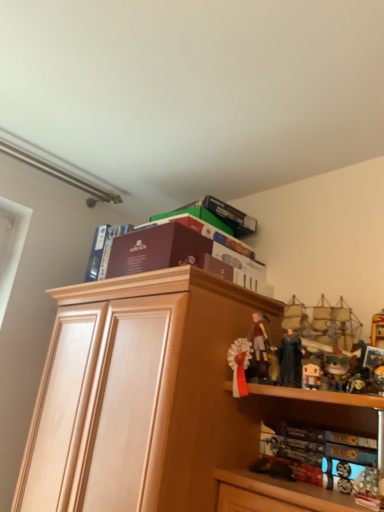
Question: From the image's perspective, is maroon cardboard book at upper center, which is counted as the 2th book, starting from the top, located beneath matte black figurine at upper right?

Choices:
 (A) yes
 (B) no

Answer: (B)

Question: Is maroon cardboard book at upper center, which appears as the third book when ordered from the bottom, oriented away from matte black figurine at upper right?

Choices:
 (A) no
 (B) yes

Answer: (A)

Question: Considering the relative positions of maroon cardboard book at upper center, which appears as the third book when ordered from the bottom, and matte black figurine at upper right in the image provided, is maroon cardboard book at upper center, which appears as the third book when ordered from the bottom, to the left of matte black figurine at upper right from the viewer's perspective?

Choices:
 (A) no
 (B) yes

Answer: (B)

Question: Does maroon cardboard book at upper center, which appears as the third book when ordered from the bottom, have a lesser height compared to matte black figurine at upper right?

Choices:
 (A) yes
 (B) no

Answer: (B)

Question: From a real-world perspective, is maroon cardboard book at upper center, which is counted as the 2th book, starting from the top, positioned under matte black figurine at upper right based on gravity?

Choices:
 (A) no
 (B) yes

Answer: (A)

Question: Is maroon cardboard box at upper center, the 2th book positioned from the bottom, bigger or smaller than matte brown box at upper center, the fourth book in the bottom-to-top sequence?

Choices:
 (A) big
 (B) small

Answer: (B)

Question: Is maroon cardboard box at upper center, marked as the third book in a top-to-bottom arrangement, inside or outside of matte brown box at upper center, the fourth book in the bottom-to-top sequence?

Choices:
 (A) outside
 (B) inside

Answer: (A)

Question: From their relative heights in the image, would you say maroon cardboard box at upper center, marked as the third book in a top-to-bottom arrangement, is taller or shorter than matte brown box at upper center, which ranks as the 1th book in top-to-bottom order?

Choices:
 (A) tall
 (B) short

Answer: (B)

Question: From the image's perspective, is maroon cardboard box at upper center, the 2th book positioned from the bottom, located above or below matte brown box at upper center, the fourth book in the bottom-to-top sequence?

Choices:
 (A) below
 (B) above

Answer: (A)

Question: Is matte brown figurine at center in front of or behind maroon cardboard book at upper center, which appears as the third book when ordered from the bottom, in the image?

Choices:
 (A) behind
 (B) front

Answer: (B)

Question: Is matte brown figurine at center bigger or smaller than maroon cardboard book at upper center, which is counted as the 2th book, starting from the top?

Choices:
 (A) small
 (B) big

Answer: (A)

Question: Is point (253, 351) closer or farther from the camera than point (92, 280)?

Choices:
 (A) closer
 (B) farther

Answer: (A)

Question: From a real-world perspective, relative to maroon cardboard book at upper center, which is counted as the 2th book, starting from the top, is matte brown figurine at center vertically above or below?

Choices:
 (A) below
 (B) above

Answer: (A)

Question: Looking at their shapes, would you say hardcover book at lower right, positioned as the 1th book in bottom-to-top order, is wider or thinner than maroon cardboard box at upper center, the 2th book positioned from the bottom?

Choices:
 (A) wide
 (B) thin

Answer: (A)

Question: Visually, is hardcover book at lower right, the fourth book positioned from the top, positioned to the left or to the right of maroon cardboard box at upper center, marked as the third book in a top-to-bottom arrangement?

Choices:
 (A) right
 (B) left

Answer: (A)